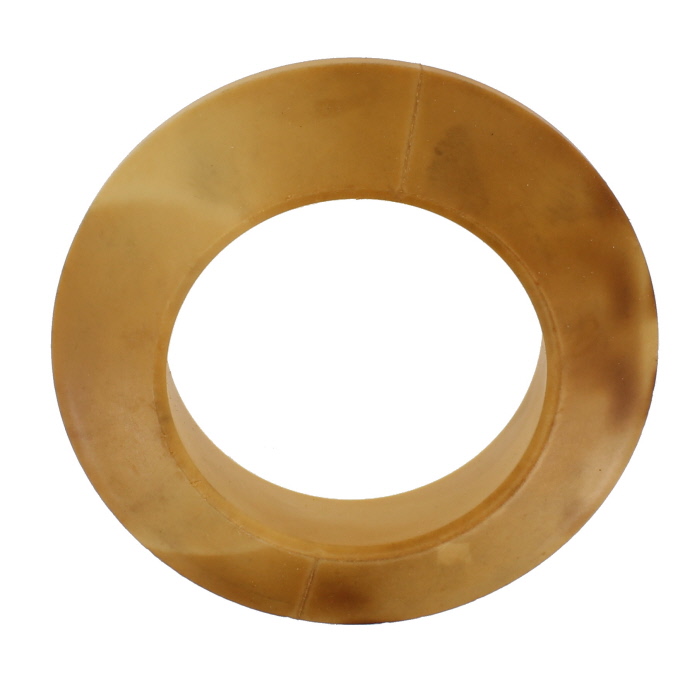
The height and width of the screenshot is (700, 700). I want to click on light spots, so click(460, 559), click(608, 472), click(150, 159).